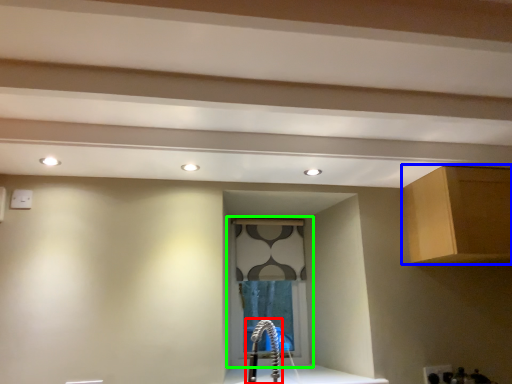
Question: Based on their relative distances, which object is nearer to faucet (highlighted by a red box)? Choose from cabinetry (highlighted by a blue box) and window (highlighted by a green box).

Choices:
 (A) cabinetry
 (B) window

Answer: (B)